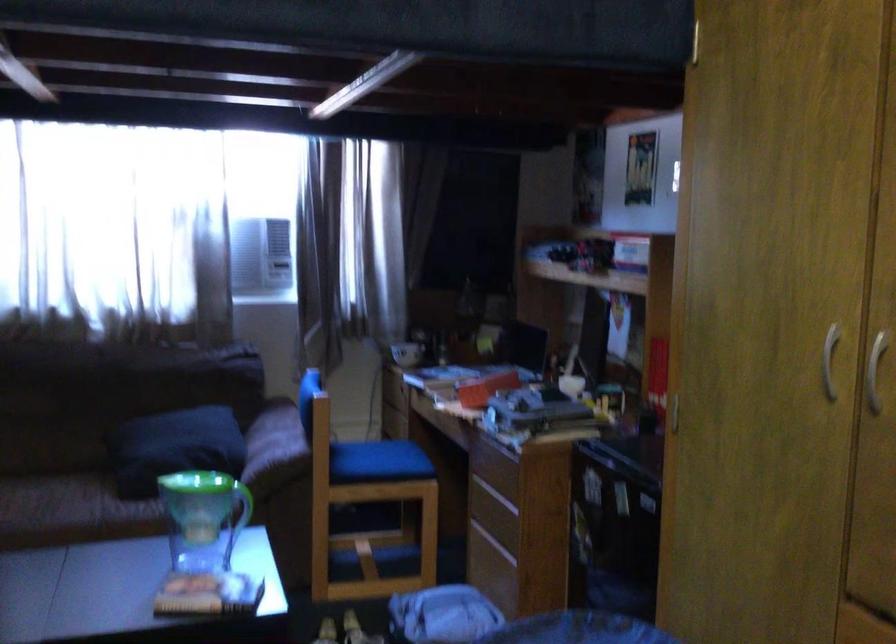
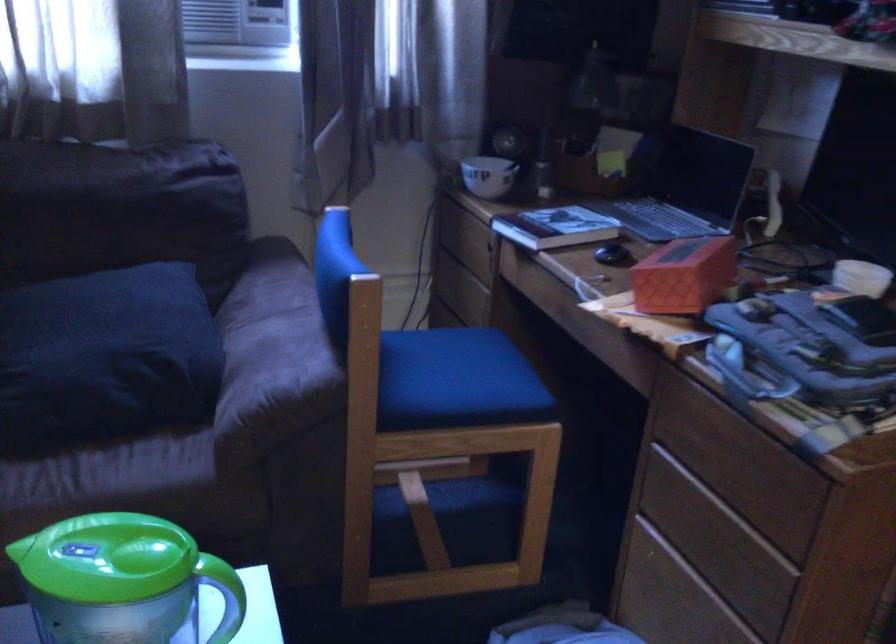
Question: I am providing you with two images of the same scene from different viewpoints. Please identify which objects are invisible in image2.

Choices:
 (A) black computer mouse
 (B) blue chair sitting surface
 (C) white ceramic bowl
 (D) none of these

Answer: (D)